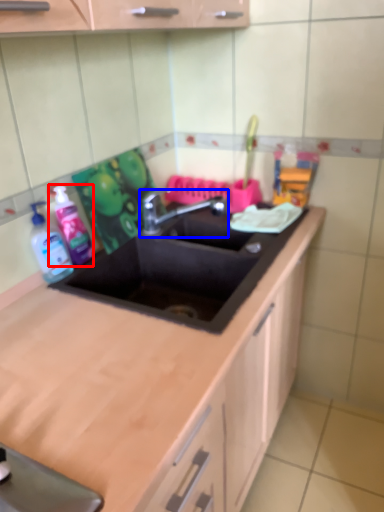
Question: Which object appears closest to the camera in this image, cleaning product (highlighted by a red box) or tap (highlighted by a blue box)?

Choices:
 (A) cleaning product
 (B) tap

Answer: (A)